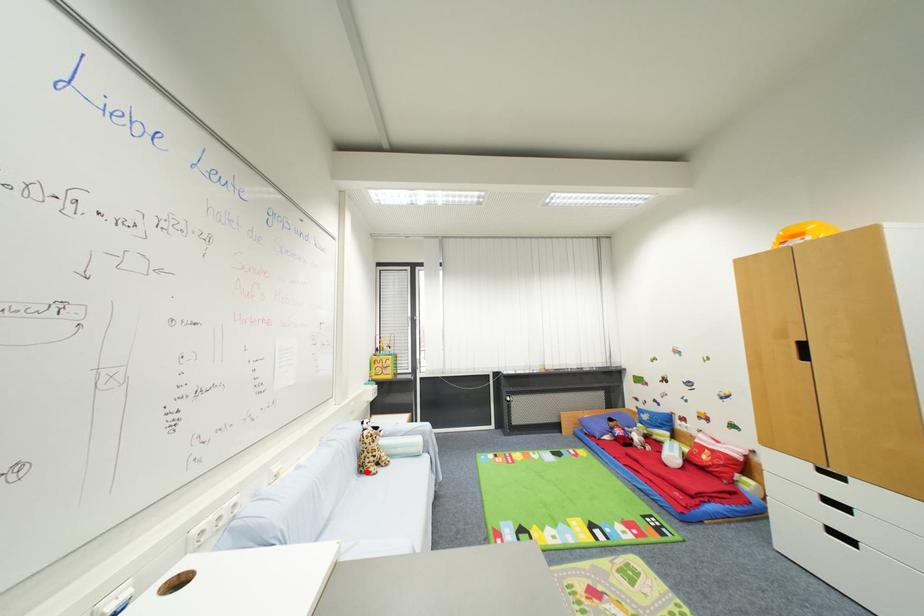
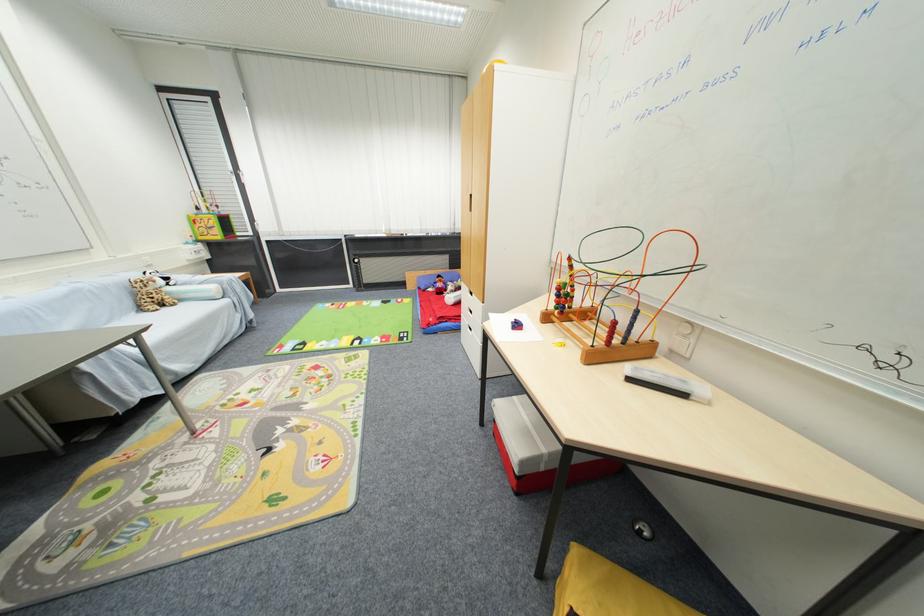
Question: I am providing you with two images of the same scene from different viewpoints. A red point is shown in image1. For the corresponding object point in image2, is it positioned nearer or farther from the camera?

Choices:
 (A) Nearer
 (B) Farther

Answer: (A)